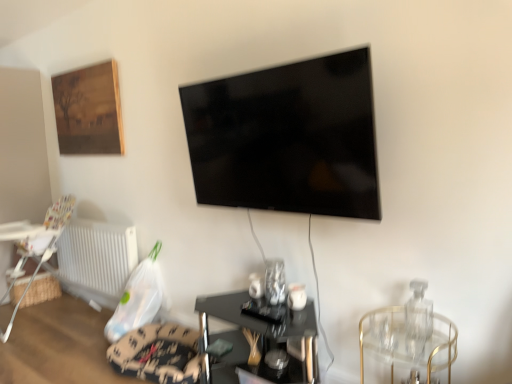
Question: Is black glass table at center, which is the 2th table from back to front, located outside wooden framed painting at upper left?

Choices:
 (A) no
 (B) yes

Answer: (B)

Question: Considering the relative sizes of black glass table at center, the second table in the left-to-right sequence, and wooden framed painting at upper left in the image provided, is black glass table at center, the second table in the left-to-right sequence, thinner than wooden framed painting at upper left?

Choices:
 (A) no
 (B) yes

Answer: (A)

Question: Is black glass table at center, the second table in the left-to-right sequence, wider than wooden framed painting at upper left?

Choices:
 (A) no
 (B) yes

Answer: (B)

Question: Is black glass table at center, the second table in the left-to-right sequence, smaller than wooden framed painting at upper left?

Choices:
 (A) no
 (B) yes

Answer: (A)

Question: Is black glass table at center, the second table in the left-to-right sequence, positioned in front of wooden framed painting at upper left?

Choices:
 (A) no
 (B) yes

Answer: (B)

Question: Is white plastic radiator at lower left taller or shorter than black glass table at center, arranged as the 1th table when viewed from the right?

Choices:
 (A) short
 (B) tall

Answer: (B)

Question: From the image's perspective, relative to black glass table at center, which is the 2th table from back to front, is white plastic radiator at lower left above or below?

Choices:
 (A) below
 (B) above

Answer: (B)

Question: Considering the positions of white plastic radiator at lower left and black glass table at center, the second table in the left-to-right sequence, in the image, is white plastic radiator at lower left bigger or smaller than black glass table at center, the second table in the left-to-right sequence,?

Choices:
 (A) big
 (B) small

Answer: (B)

Question: Relative to black glass table at center, the second table in the left-to-right sequence, is white plastic radiator at lower left in front or behind?

Choices:
 (A) front
 (B) behind

Answer: (B)

Question: Is clear glass table at right spatially inside wooden framed painting at upper left, or outside of it?

Choices:
 (A) outside
 (B) inside

Answer: (A)

Question: Is clear glass table at right in front of or behind wooden framed painting at upper left in the image?

Choices:
 (A) behind
 (B) front

Answer: (B)

Question: From the image's perspective, is clear glass table at right located above or below wooden framed painting at upper left?

Choices:
 (A) above
 (B) below

Answer: (B)

Question: From a real-world perspective, relative to wooden framed painting at upper left, is clear glass table at right vertically above or below?

Choices:
 (A) below
 (B) above

Answer: (A)

Question: From the image's perspective, is white plastic highchair at lower left located above or below clear glass table at right?

Choices:
 (A) below
 (B) above

Answer: (B)

Question: Is white plastic highchair at lower left spatially inside clear glass table at right, or outside of it?

Choices:
 (A) inside
 (B) outside

Answer: (B)